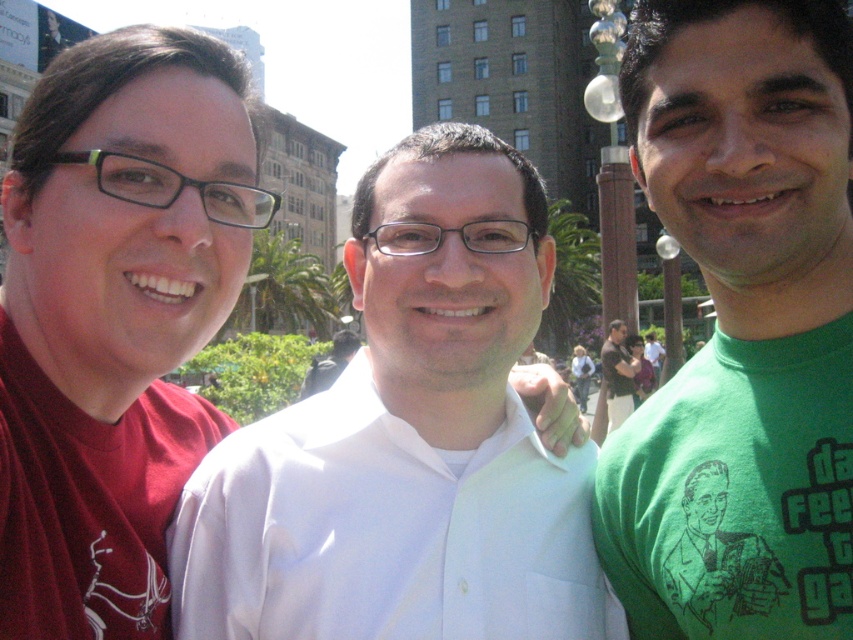
Question: Based on their relative distances, which object is farther from the white cotton shirt at center?

Choices:
 (A) matte red shirt at left
 (B) green printed t-shirt at right
 (C) matte brown hair at center
 (D) blonde hair at center

Answer: (D)

Question: In this image, where is matte red shirt at left located relative to white cotton shirt at center?

Choices:
 (A) right
 (B) left

Answer: (B)

Question: Which of the following is the closest to the observer?

Choices:
 (A) matte brown hair at center
 (B) green printed t-shirt at right
 (C) white cotton shirt at center

Answer: (B)

Question: From the image, what is the correct spatial relationship of matte red shirt at left in relation to blonde hair at center?

Choices:
 (A) below
 (B) above

Answer: (B)

Question: Does matte red shirt at left appear under matte brown hair at center?

Choices:
 (A) no
 (B) yes

Answer: (A)

Question: Which of the following is the farthest from the observer?

Choices:
 (A) (813, 10)
 (B) (625, 392)
 (C) (6, 554)
 (D) (583, 410)

Answer: (D)